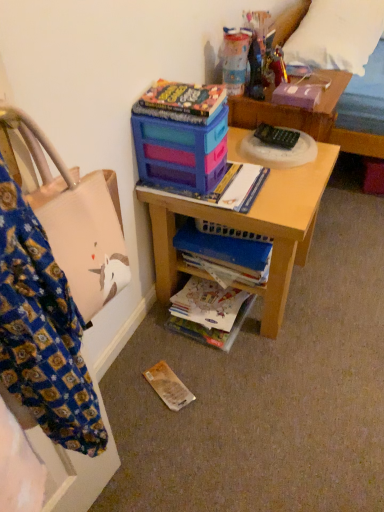
What are the coordinates of `vacant space that's between wooden desk at center and brown paper book at lower center, positioned as the third paperback book in top-to-bottom order` in the screenshot? It's located at (191, 354).